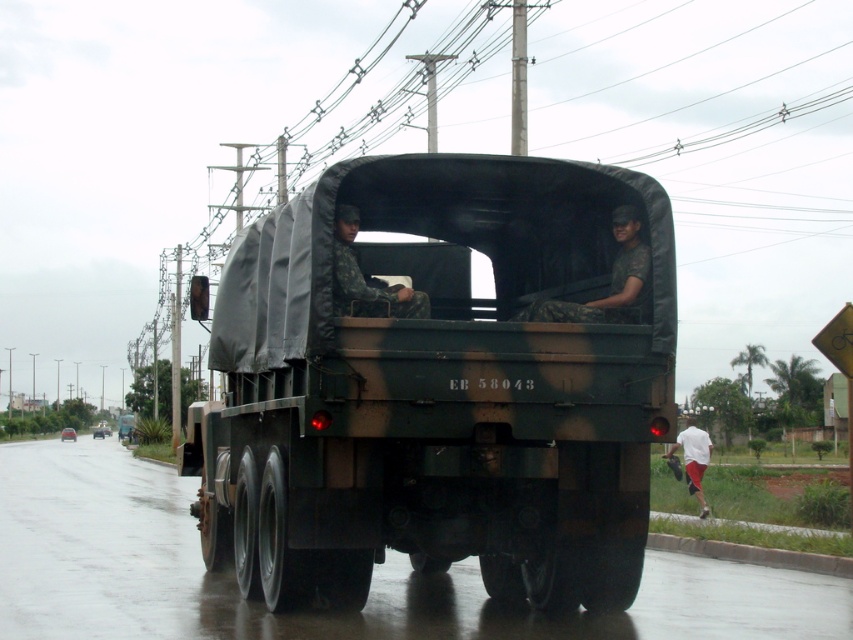
You are a drone operator trying to locate the camouflage fabric truck at center. According to the coordinates provided, where should you direct your drone to find it?

The camouflage fabric truck at center is located at coordinates point (440, 381).

You are a photographer trying to capture the camouflage fabric truck at center and the camouflage fabric uniform at rear in a single shot. Given that your camera can only focus on objects within a 10 meter range, and the truck is farther away than the uniform, can you still include both in your photo?

The camouflage fabric truck at center is larger in size compared to camouflage fabric uniform at rear. However, since the truck is farther away than the uniform, its actual distance might exceed the 10 meter focus range. Without knowing the exact distance, it is uncertain if both can be captured in one shot.

You are a soldier in the truck and need to secure a package in the cargo area. The package must be placed exactly at point (610, 282). What object is located there that you should avoid covering?

The camouflage fabric uniform at rear is located at point (610, 282), so you should avoid covering it when placing the package there.